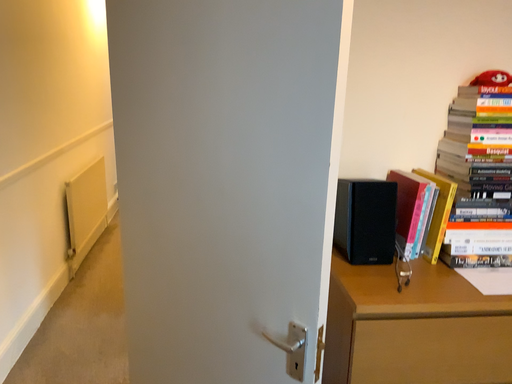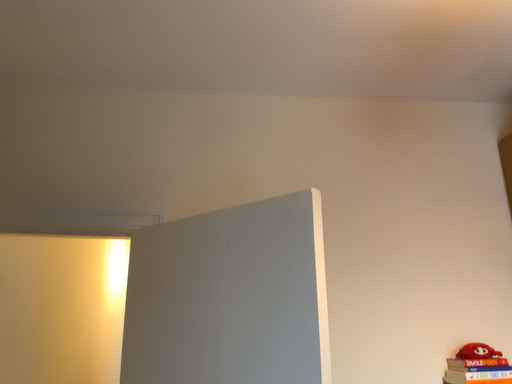
Question: How did the camera likely rotate when shooting the video?

Choices:
 (A) rotated downward
 (B) rotated upward

Answer: (B)